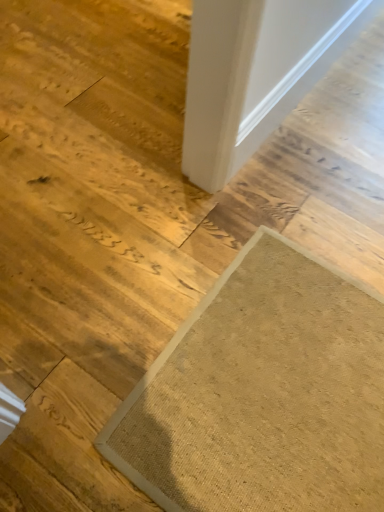
Locate an element on the screen. The image size is (384, 512). textured beige mat at lower right is located at coordinates (263, 394).

The height and width of the screenshot is (512, 384). What do you see at coordinates (263, 394) in the screenshot?
I see `textured beige mat at lower right` at bounding box center [263, 394].

Measure the distance between point (226, 467) and camera.

Point (226, 467) is 3.28 feet away from camera.

Describe the element at coordinates (255, 73) in the screenshot. I see `white smooth door at upper right` at that location.

The height and width of the screenshot is (512, 384). What are the coordinates of `white smooth door at upper right` in the screenshot? It's located at (255, 73).

Where is `textured beige mat at lower right`? The width and height of the screenshot is (384, 512). textured beige mat at lower right is located at coordinates (263, 394).

Is textured beige mat at lower right to the left of white smooth door at upper right from the viewer's perspective?

Correct, you'll find textured beige mat at lower right to the left of white smooth door at upper right.

Does textured beige mat at lower right come in front of white smooth door at upper right?

Yes, it is in front of white smooth door at upper right.

Between point (339, 364) and point (318, 23), which one is positioned behind?

The point (318, 23) is behind.

From the image's perspective, is textured beige mat at lower right above or below white smooth door at upper right?

textured beige mat at lower right is below white smooth door at upper right.

From a real-world perspective, is textured beige mat at lower right on white smooth door at upper right?

Actually, textured beige mat at lower right is physically below white smooth door at upper right in the real world.

Looking at their sizes, would you say textured beige mat at lower right is wider or thinner than white smooth door at upper right?

Clearly, textured beige mat at lower right has more width compared to white smooth door at upper right.

Which of these two, textured beige mat at lower right or white smooth door at upper right, stands taller?

white smooth door at upper right is taller.

Which of these two, textured beige mat at lower right or white smooth door at upper right, is smaller?

Smaller between the two is white smooth door at upper right.

Is textured beige mat at lower right outside of white smooth door at upper right?

textured beige mat at lower right lies outside white smooth door at upper right's area.

Would you consider textured beige mat at lower right to be distant from white smooth door at upper right?

textured beige mat at lower right is near white smooth door at upper right, not far away.

Does textured beige mat at lower right turn towards white smooth door at upper right?

No, textured beige mat at lower right is not oriented towards white smooth door at upper right.

How different are the orientations of textured beige mat at lower right and white smooth door at upper right in degrees?

The facing directions of textured beige mat at lower right and white smooth door at upper right are 179 degrees apart.

Identify the location of mat directly beneath the white smooth door at upper right (from a real-world perspective). (263, 394).

Can you confirm if white smooth door at upper right is positioned to the left of textured beige mat at lower right?

No.

Considering the positions of objects white smooth door at upper right and textured beige mat at lower right in the image provided, who is in front, white smooth door at upper right or textured beige mat at lower right?

textured beige mat at lower right is closer to the camera.

Between point (241, 137) and point (357, 303), which one is positioned behind?

The point (241, 137) is behind.

From the image's perspective, would you say white smooth door at upper right is positioned over textured beige mat at lower right?

Yes.

From a real-world perspective, which is physically above, white smooth door at upper right or textured beige mat at lower right?

In real-world perspective, white smooth door at upper right is above.

Considering the sizes of objects white smooth door at upper right and textured beige mat at lower right in the image provided, who is thinner, white smooth door at upper right or textured beige mat at lower right?

Thinner between the two is white smooth door at upper right.

Is white smooth door at upper right taller than textured beige mat at lower right?

Indeed, white smooth door at upper right has a greater height compared to textured beige mat at lower right.

Considering the relative sizes of white smooth door at upper right and textured beige mat at lower right in the image provided, is white smooth door at upper right smaller than textured beige mat at lower right?

Indeed, white smooth door at upper right has a smaller size compared to textured beige mat at lower right.

Is white smooth door at upper right not within textured beige mat at lower right?

white smooth door at upper right is positioned outside textured beige mat at lower right.

Are white smooth door at upper right and textured beige mat at lower right far apart?

white smooth door at upper right is actually quite close to textured beige mat at lower right.

Looking at this image, could you tell me if white smooth door at upper right is facing textured beige mat at lower right?

No, white smooth door at upper right is not facing towards textured beige mat at lower right.

What's the angular difference between white smooth door at upper right and textured beige mat at lower right's facing directions?

179 degrees separate the facing orientations of white smooth door at upper right and textured beige mat at lower right.

Identify the location of door located above the textured beige mat at lower right (from the image's perspective). The width and height of the screenshot is (384, 512). (255, 73).

The image size is (384, 512). I want to click on door lying behind the textured beige mat at lower right, so click(255, 73).

The image size is (384, 512). I want to click on mat that is under the white smooth door at upper right (from a real-world perspective), so click(263, 394).